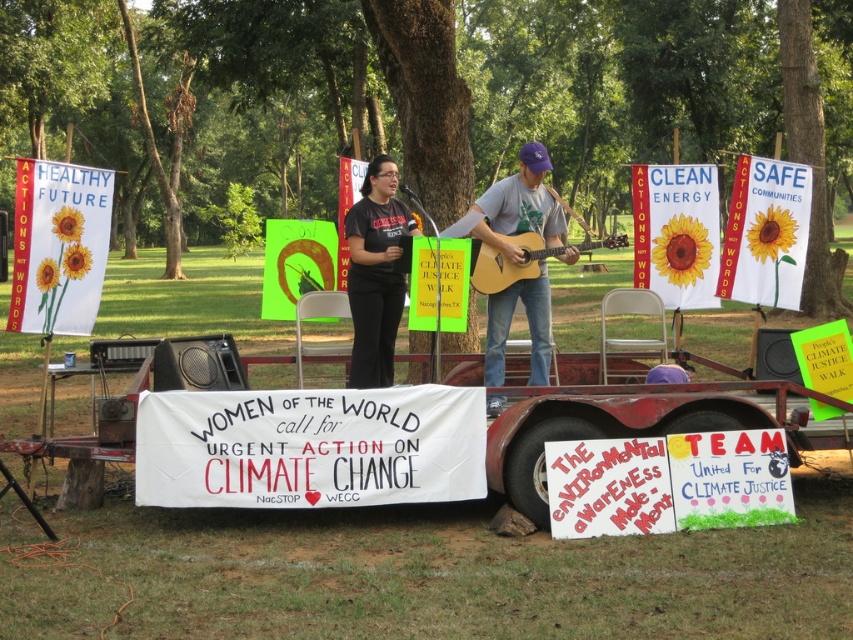
Question: Is black t-shirt at center positioned in front of acoustic wood guitar at center?

Choices:
 (A) yes
 (B) no

Answer: (B)

Question: Which of these objects is positioned farthest from the acoustic wood guitar at center?

Choices:
 (A) matte gray t-shirt at center
 (B) black t-shirt at center

Answer: (B)

Question: Is black t-shirt at center above acoustic wood guitar at center?

Choices:
 (A) yes
 (B) no

Answer: (B)

Question: Can you confirm if matte gray t-shirt at center is positioned to the left of black t-shirt at center?

Choices:
 (A) no
 (B) yes

Answer: (A)

Question: Which is nearer to the black t-shirt at center?

Choices:
 (A) matte gray t-shirt at center
 (B) acoustic wood guitar at center

Answer: (A)

Question: Which of these objects is positioned farthest from the acoustic wood guitar at center?

Choices:
 (A) matte gray t-shirt at center
 (B) black t-shirt at center

Answer: (B)